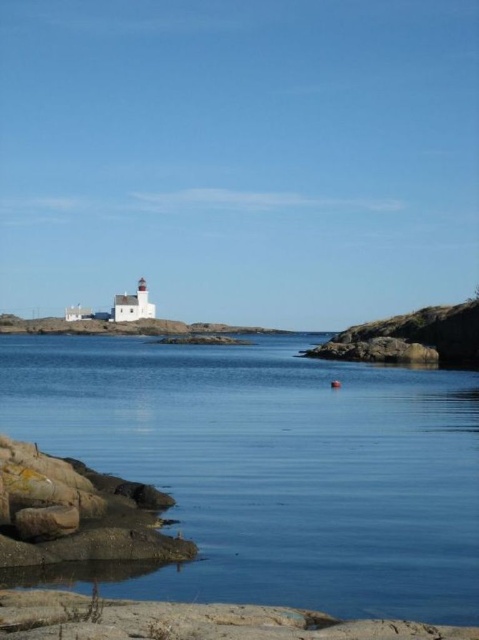
A boat is anchored at the blue smooth water at center. The boat needs to reach the rusty stone rocks at lower left for a quick stop. What is the minimum distance the boat must travel to reach the rocks?

The blue smooth water at center is 22.33 meters away from the rusty stone rocks at lower left, so the boat must travel at least 22.33 meters to reach the rocks.